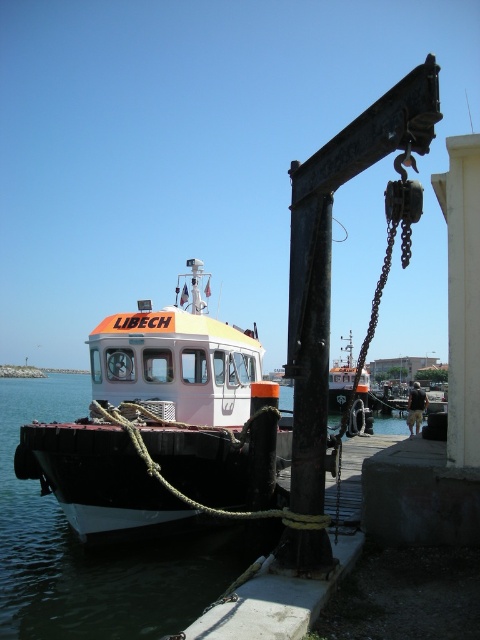
You are a dock worker who needs to secure both the white matte boat at center and orange matte boat at center. Since the metal gantry crane on the right can only reach objects to its left, which boat should you secure first?

The white matte boat at center is to the left of the orange matte boat at center, so the metal gantry crane on the right can only reach the white matte boat at center first.

You are a ship captain trying to dock your vessel at the harbor. You see the black rubber water at lower left. Where is the black rubber water located in the harbor scene?

The black rubber water at lower left is located at point [92,548] in the harbor scene.

You are a dock worker who needs to secure the white matte boat at center to the dock. The black rubber water at lower left is an obstacle. Which direction should you move the boat to avoid the obstacle?

The white matte boat at center is on the right side of the black rubber water at lower left. To avoid the obstacle, you should move the boat to the left.